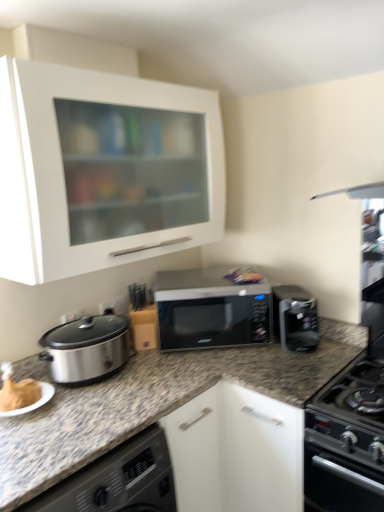
Where is `white matte cabinet at upper left`? This screenshot has height=512, width=384. white matte cabinet at upper left is located at coordinates (64, 172).

Measure the distance between satin black coffee maker at right and camera.

The distance of satin black coffee maker at right from camera is 5.99 feet.

Where is `sleek black microwave at center`? This screenshot has width=384, height=512. sleek black microwave at center is located at coordinates (211, 310).

Where is `microwave oven that is above the black matte oven at lower right (from a real-world perspective)`? The height and width of the screenshot is (512, 384). microwave oven that is above the black matte oven at lower right (from a real-world perspective) is located at coordinates (211, 310).

Is sleek black microwave at center to the left or to the right of black matte oven at lower right in the image?

From the image, it's evident that sleek black microwave at center is to the left of black matte oven at lower right.

Considering the positions of points (188, 320) and (311, 479), is point (188, 320) closer to camera compared to point (311, 479)?

No, (188, 320) is further to viewer.

From a real-world perspective, is sleek black microwave at center positioned over black matte oven at lower right based on gravity?

Yes, from a real-world perspective, sleek black microwave at center is on top of black matte oven at lower right.

Is satin black coffee maker at right positioned with its back to sleek black microwave at center?

satin black coffee maker at right does not have its back to sleek black microwave at center.

From a real-world perspective, is satin black coffee maker at right positioned above or below sleek black microwave at center?

From a real-world perspective, satin black coffee maker at right is physically below sleek black microwave at center.

Which object is further away from the camera, satin black coffee maker at right or sleek black microwave at center?

sleek black microwave at center.

Is point (303, 292) positioned in front of point (174, 271)?

Yes, it is.

The width and height of the screenshot is (384, 512). In order to click on cabinetry above the black matte oven at lower right (from a real-world perspective) in this screenshot , I will do `click(64, 172)`.

From the image's perspective, who appears lower, white matte cabinet at upper left or black matte oven at lower right?

black matte oven at lower right appears lower in the image.

Is white matte cabinet at upper left with black matte oven at lower right?

No, white matte cabinet at upper left is not next to black matte oven at lower right.

Does white matte cabinet at upper left come behind sleek black microwave at center?

That is False.

Is white matte cabinet at upper left touching sleek black microwave at center?

No, white matte cabinet at upper left is not in contact with sleek black microwave at center.

Considering the positions of point (8, 84) and point (202, 307), is point (8, 84) closer or farther from the camera than point (202, 307)?

Point (8, 84) appears to be closer to the viewer than point (202, 307).

From the image's perspective, which one is positioned higher, white matte cabinet at upper left or sleek black microwave at center?

white matte cabinet at upper left appears higher in the image.

Identify the location of microwave oven that appears in front of the multicolored plastic bag at center. The width and height of the screenshot is (384, 512). (211, 310).

Is sleek black microwave at center aimed at multicolored plastic bag at center?

No, sleek black microwave at center is not facing towards multicolored plastic bag at center.

Is sleek black microwave at center bigger than multicolored plastic bag at center?

Correct, sleek black microwave at center is larger in size than multicolored plastic bag at center.

Consider the image. Relative to multicolored plastic bag at center, is sleek black microwave at center in front or behind?

Clearly, sleek black microwave at center is in front of multicolored plastic bag at center.

Is the position of satin black coffee maker at right more distant than that of white matte cabinet at upper left?

Yes, satin black coffee maker at right is behind white matte cabinet at upper left.

Which is more to the left, satin black coffee maker at right or white matte cabinet at upper left?

white matte cabinet at upper left.

Would you say white matte cabinet at upper left is part of satin black coffee maker at right's contents?

No, white matte cabinet at upper left is located outside of satin black coffee maker at right.

Considering the sizes of objects sleek black microwave at center and white matte cabinet at upper left in the image provided, who is bigger, sleek black microwave at center or white matte cabinet at upper left?

With larger size is white matte cabinet at upper left.

Does sleek black microwave at center touch white matte cabinet at upper left?

No, sleek black microwave at center is not beside white matte cabinet at upper left.

Is sleek black microwave at center oriented towards white matte cabinet at upper left?

No.

In the scene shown: From the image's perspective, which is below, sleek black microwave at center or white matte cabinet at upper left?

sleek black microwave at center, from the image's perspective.

Image resolution: width=384 pixels, height=512 pixels. In the image, there is a sleek black microwave at center. In order to click on oven below it (from the image's perspective) in this screenshot , I will do `click(341, 466)`.

Locate an element on the screen. The width and height of the screenshot is (384, 512). microwave oven on the left of the satin black coffee maker at right is located at coordinates (211, 310).

Based on the photo, considering their positions, is sleek black microwave at center positioned closer to multicolored plastic bag at center than black matte oven at lower right?

Among the two, sleek black microwave at center is located nearer to multicolored plastic bag at center.

From the image, which object appears to be farther from black matte oven at lower right, satin black coffee maker at right or multicolored plastic bag at center?

multicolored plastic bag at center lies further to black matte oven at lower right than the other object.

Based on their spatial positions, is multicolored plastic bag at center or black matte oven at lower right closer to satin black coffee maker at right?

multicolored plastic bag at center.

Estimate the real-world distances between objects in this image. Which object is further from multicolored plastic bag at center, satin black coffee maker at right or sleek black microwave at center?

Among the two, satin black coffee maker at right is located further to multicolored plastic bag at center.

From the image, which object appears to be farther from black matte oven at lower right, multicolored plastic bag at center or sleek black microwave at center?

multicolored plastic bag at center is positioned further to the anchor black matte oven at lower right.

Estimate the real-world distances between objects in this image. Which object is closer to satin black coffee maker at right, white matte cabinet at upper left or black matte oven at lower right?

The object closer to satin black coffee maker at right is black matte oven at lower right.

Looking at the image, which one is located closer to satin black coffee maker at right, black matte oven at lower right or white matte cabinet at upper left?

black matte oven at lower right is positioned closer to the anchor satin black coffee maker at right.

Looking at the image, which one is located closer to white matte cabinet at upper left, multicolored plastic bag at center or black matte oven at lower right?

multicolored plastic bag at center.

Where is `microwave oven between white matte cabinet at upper left and multicolored plastic bag at center in the front-back direction`? The image size is (384, 512). microwave oven between white matte cabinet at upper left and multicolored plastic bag at center in the front-back direction is located at coordinates (211, 310).

Find the location of a particular element. The width and height of the screenshot is (384, 512). microwave oven between white matte cabinet at upper left and black matte oven at lower right in the up-down direction is located at coordinates (211, 310).

Identify the location of food situated between sleek black microwave at center and satin black coffee maker at right from left to right. point(243,276).

The height and width of the screenshot is (512, 384). I want to click on microwave oven between multicolored plastic bag at center and black matte oven at lower right vertically, so click(x=211, y=310).